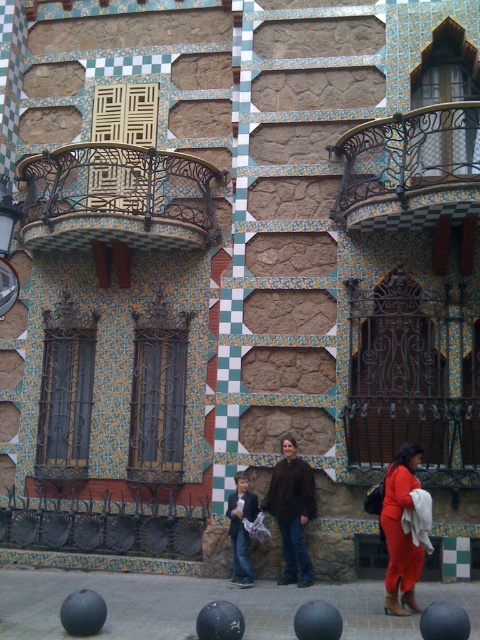
Does brown leather jacket at center lie behind matte orange dress at lower right?

That is True.

From the picture: Is brown leather jacket at center above matte orange dress at lower right?

Yes, brown leather jacket at center is above matte orange dress at lower right.

Which is behind, point (269, 497) or point (400, 524)?

The point (269, 497) is behind.

Where is `brown leather jacket at center`? brown leather jacket at center is located at coordinates (291, 509).

Does black wrought iron balcony at upper right appear under denim jacket at center?

Incorrect, black wrought iron balcony at upper right is not positioned below denim jacket at center.

Who is taller, black wrought iron balcony at upper right or denim jacket at center?

Standing taller between the two is black wrought iron balcony at upper right.

Does point (406, 212) come behind point (237, 534)?

No, (406, 212) is in front of (237, 534).

Locate an element on the screen. This screenshot has height=640, width=480. black wrought iron balcony at upper right is located at coordinates (408, 168).

Is point (124, 221) positioned after point (396, 534)?

Yes, it is behind point (396, 534).

Image resolution: width=480 pixels, height=640 pixels. What do you see at coordinates (118, 198) in the screenshot? I see `dark brown wrought iron balcony at upper left` at bounding box center [118, 198].

Does point (40, 240) lie in front of point (420, 452)?

No, it is behind (420, 452).

Where is `dark brown wrought iron balcony at upper left`? Image resolution: width=480 pixels, height=640 pixels. dark brown wrought iron balcony at upper left is located at coordinates (118, 198).